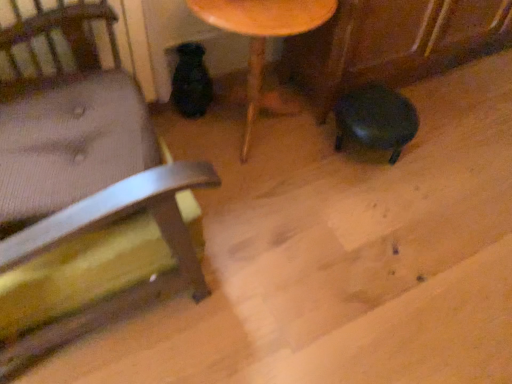
Question: Considering the relative sizes of wooden table at center and matte black stool at lower right in the image provided, is wooden table at center shorter than matte black stool at lower right?

Choices:
 (A) yes
 (B) no

Answer: (B)

Question: Does wooden table at center lie behind matte black stool at lower right?

Choices:
 (A) yes
 (B) no

Answer: (B)

Question: Can you confirm if wooden table at center is thinner than matte black stool at lower right?

Choices:
 (A) yes
 (B) no

Answer: (B)

Question: Can you confirm if wooden table at center is wider than matte black stool at lower right?

Choices:
 (A) no
 (B) yes

Answer: (B)

Question: Would you say wooden table at center is outside matte black stool at lower right?

Choices:
 (A) yes
 (B) no

Answer: (A)

Question: From the image's perspective, is wooden table at center over matte black stool at lower right?

Choices:
 (A) no
 (B) yes

Answer: (B)

Question: Is wooden chair at left inside matte black stool at lower right?

Choices:
 (A) yes
 (B) no

Answer: (B)

Question: From the image's perspective, would you say matte black stool at lower right is shown under wooden chair at left?

Choices:
 (A) yes
 (B) no

Answer: (B)

Question: Is matte black stool at lower right far away from wooden chair at left?

Choices:
 (A) yes
 (B) no

Answer: (B)

Question: Is matte black stool at lower right next to wooden chair at left and touching it?

Choices:
 (A) yes
 (B) no

Answer: (B)

Question: Is matte black stool at lower right to the left of wooden chair at left from the viewer's perspective?

Choices:
 (A) yes
 (B) no

Answer: (B)

Question: From a real-world perspective, is matte black stool at lower right positioned under wooden chair at left based on gravity?

Choices:
 (A) yes
 (B) no

Answer: (A)

Question: Is wooden chair at left in contact with matte black stool at lower right?

Choices:
 (A) yes
 (B) no

Answer: (B)